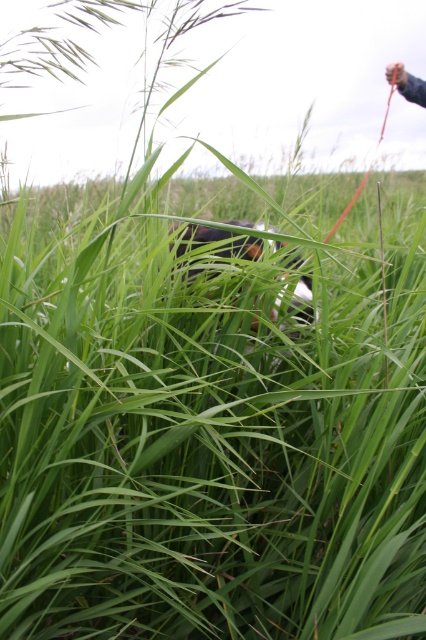
Question: Does green grassy field at center appear over smooth skin hand at upper right?

Choices:
 (A) yes
 (B) no

Answer: (B)

Question: Is green grassy field at center bigger than black fur dog at center?

Choices:
 (A) yes
 (B) no

Answer: (A)

Question: Which point is farther to the camera?

Choices:
 (A) smooth skin hand at upper right
 (B) black fur dog at center

Answer: (A)

Question: Is green grassy field at center to the left of smooth skin hand at upper right from the viewer's perspective?

Choices:
 (A) no
 (B) yes

Answer: (B)

Question: Which of the following is the farthest from the observer?

Choices:
 (A) (242, 248)
 (B) (402, 92)
 (C) (250, 392)

Answer: (B)

Question: Which object is farther from the camera taking this photo?

Choices:
 (A) smooth skin hand at upper right
 (B) black fur dog at center
 (C) green grassy field at center

Answer: (A)